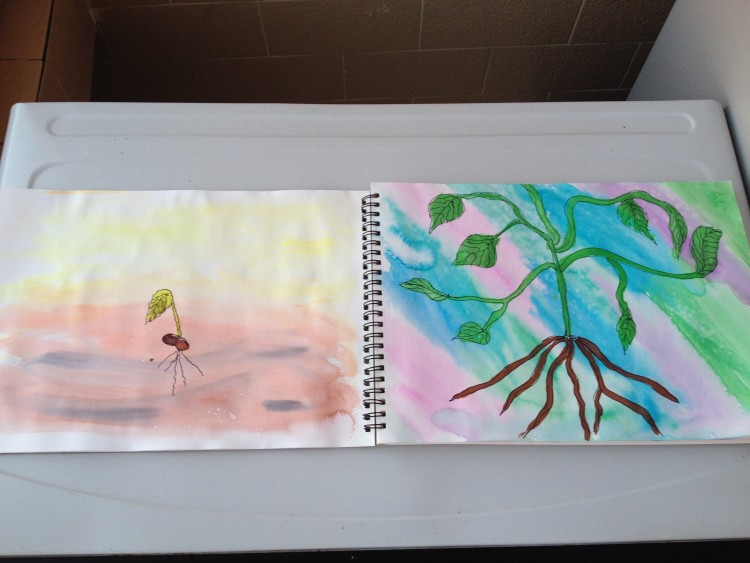
Locate an element on the screen. Image resolution: width=750 pixels, height=563 pixels. brick wall is located at coordinates (298, 68).